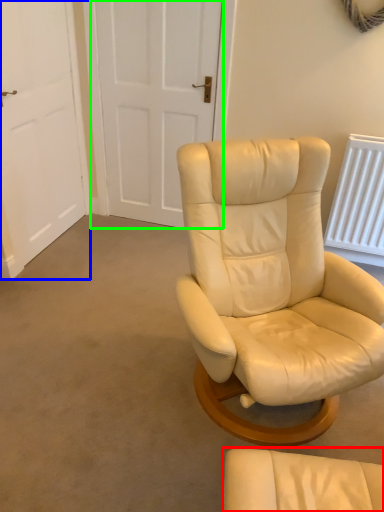
Question: Estimate the real-world distances between objects in this image. Which object is closer to chair (highlighted by a red box), door (highlighted by a blue box) or door (highlighted by a green box)?

Choices:
 (A) door
 (B) door

Answer: (A)